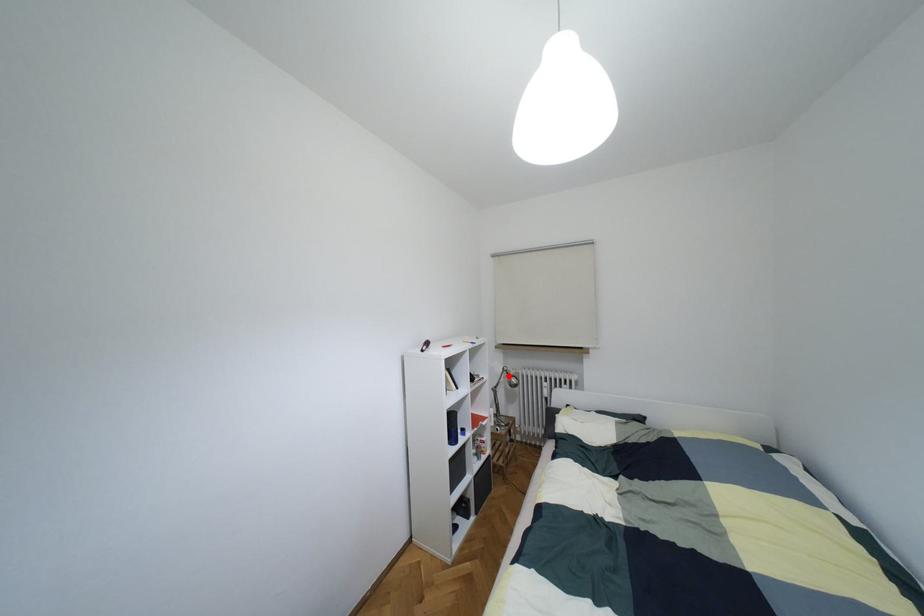
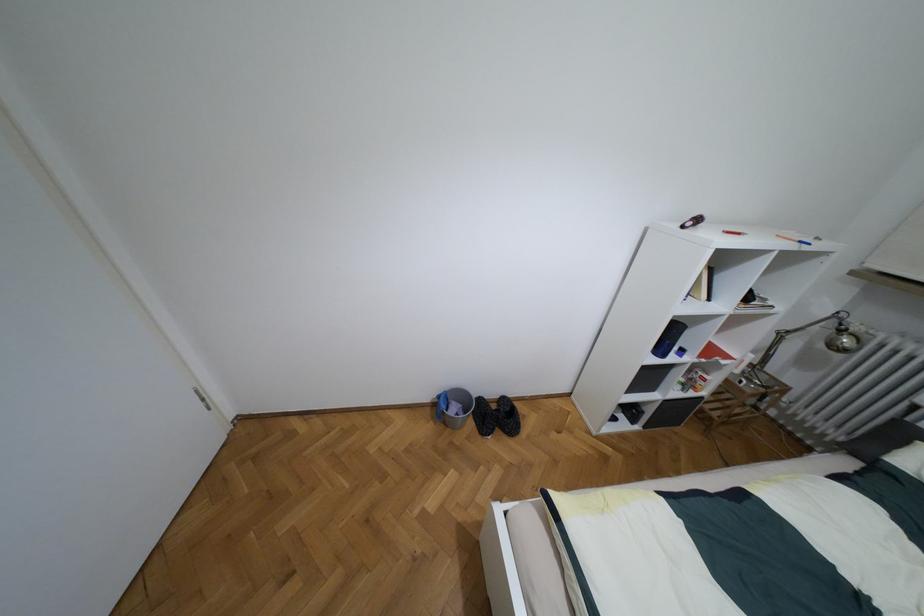
Question: A red point is marked in image1. In image2, is the corresponding 3D point closer to the camera or farther? Reply with the corresponding letter.

Choices:
 (A) The corresponding 3D point is closer.
 (B) The corresponding 3D point is farther.

Answer: (A)